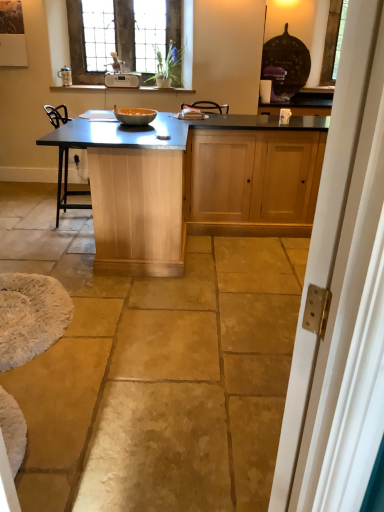
The height and width of the screenshot is (512, 384). Find the location of `vacant area that lies to the right of white fluffy rug at lower left`. vacant area that lies to the right of white fluffy rug at lower left is located at coordinates (127, 329).